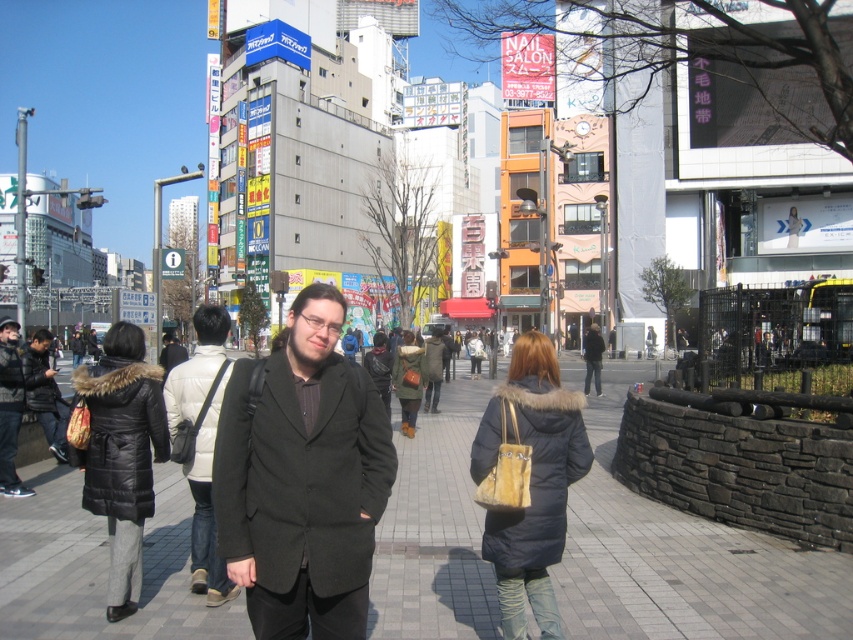
Question: Is brick pavement at center closer to camera compared to dark gray wool coat at center?

Choices:
 (A) yes
 (B) no

Answer: (B)

Question: Is dark gray wool coat at center positioned before black matte jacket at center?

Choices:
 (A) no
 (B) yes

Answer: (B)

Question: Which object is the farthest from the brick pavement at center?

Choices:
 (A) black matte jacket at center
 (B) dark gray wool coat at center

Answer: (B)

Question: Which is farther from the dark gray wool coat at center?

Choices:
 (A) black matte jacket at center
 (B) brick pavement at center

Answer: (B)

Question: Estimate the real-world distances between objects in this image. Which object is farther from the dark gray wool coat at center?

Choices:
 (A) brick pavement at center
 (B) black matte jacket at center

Answer: (A)

Question: Is brick pavement at center below black matte jacket at center?

Choices:
 (A) no
 (B) yes

Answer: (B)